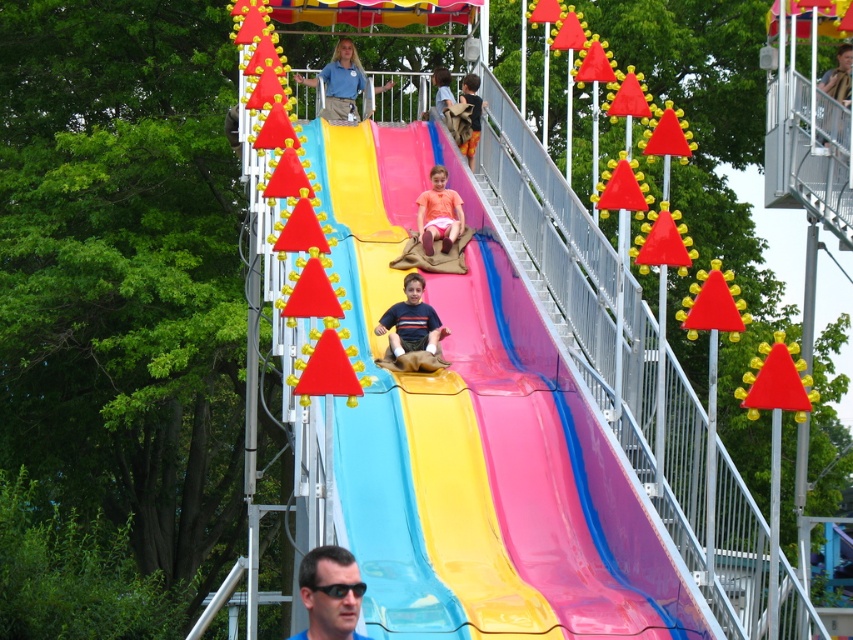
Which is more to the right, matte blue shirt at upper center or matte pink shorts at center?

matte pink shorts at center is more to the right.

Is point (337, 68) less distant than point (434, 166)?

No, it is behind (434, 166).

The width and height of the screenshot is (853, 640). What are the coordinates of `matte blue shirt at upper center` in the screenshot? It's located at (339, 81).

Can you confirm if matte blue shirt at upper center is positioned to the right of tan fabric bag at center?

No, matte blue shirt at upper center is not to the right of tan fabric bag at center.

Who is more forward, (341, 42) or (466, 154)?

Positioned in front is point (466, 154).

The width and height of the screenshot is (853, 640). In order to click on matte blue shirt at upper center in this screenshot , I will do `click(339, 81)`.

Does shiny plastic slide at center have a lesser width compared to matte blue shirt at upper center?

No, shiny plastic slide at center is not thinner than matte blue shirt at upper center.

Is shiny plastic slide at center above matte blue shirt at upper center?

No, shiny plastic slide at center is not above matte blue shirt at upper center.

Does point (589, 467) come behind point (343, 113)?

No, it is in front of (343, 113).

Find the location of a particular element. This screenshot has width=853, height=640. shiny plastic slide at center is located at coordinates (543, 474).